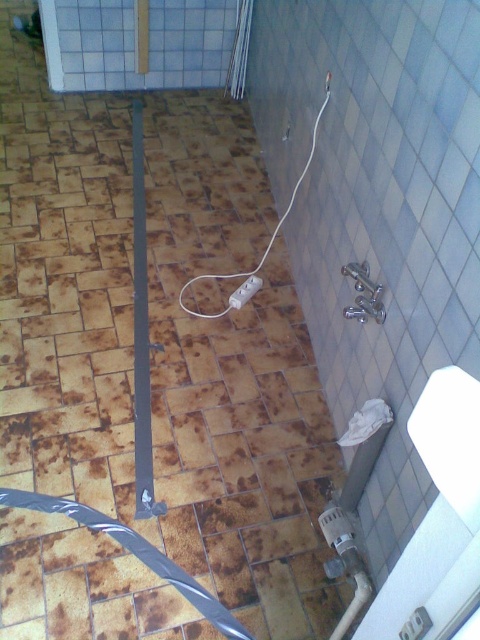
Question: Among these points, which one is nearest to the camera?

Choices:
 (A) (230, 292)
 (B) (379, 410)

Answer: (B)

Question: Does white matte toilet paper at lower right have a smaller size compared to white plastic plug at center?

Choices:
 (A) no
 (B) yes

Answer: (A)

Question: Is white matte toilet paper at lower right positioned at the back of white plastic plug at center?

Choices:
 (A) no
 (B) yes

Answer: (A)

Question: Does white matte toilet paper at lower right have a larger size compared to white plastic plug at center?

Choices:
 (A) yes
 (B) no

Answer: (A)